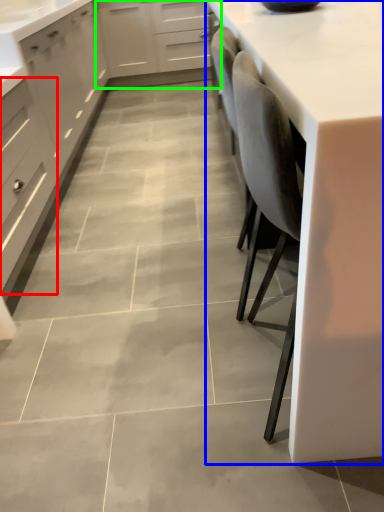
Question: Which object is positioned closest to drawer (highlighted by a red box)? Select from countertop (highlighted by a blue box) and cabinetry (highlighted by a green box).

Choices:
 (A) countertop
 (B) cabinetry

Answer: (A)